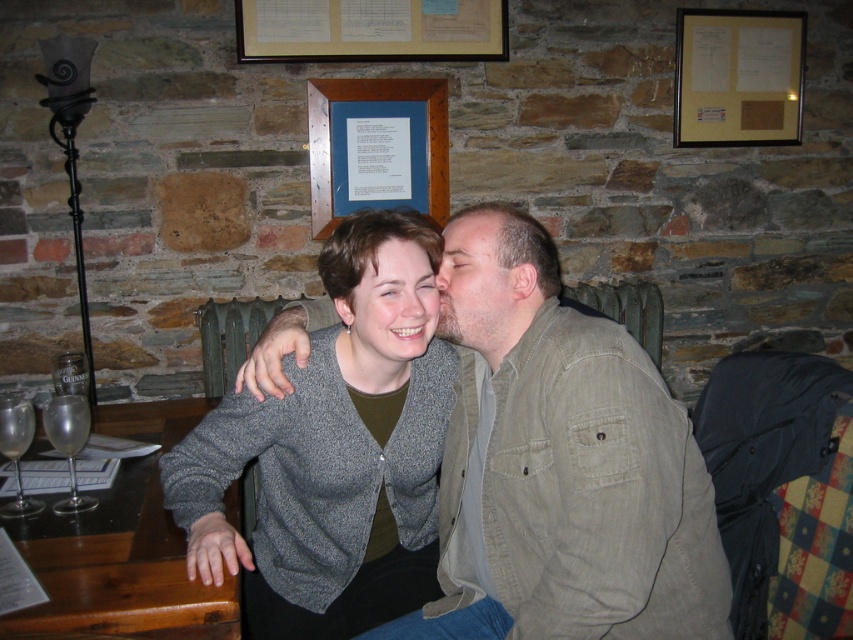
You are a photographer taking a picture of the wooden framed paper at upper center and the clear glass wine at lower left. Which object should you focus on if you want to capture the larger one?

The wooden framed paper at upper center is bigger than the clear glass wine at lower left, so you should focus on the wooden framed paper at upper center to capture the larger one.

You are a photographer standing 2 meters away from the gray wool sweater at center. You want to take a photo of the two people sitting at the table. Do you need to move closer to get both of them in the frame?

The two people are 1.14 meters apart, so if you are 2 meters away from the gray wool sweater at center, you should be able to capture both individuals in the frame without needing to move closer.

Based on the photo, you are standing in the rustic setting and want to read the text on the white paper at upper center. Considering your current position, can you comfortably read the text without moving closer?

The white paper at upper center is 2.55 meters away from you, so it might be difficult to read the text comfortably without moving closer.